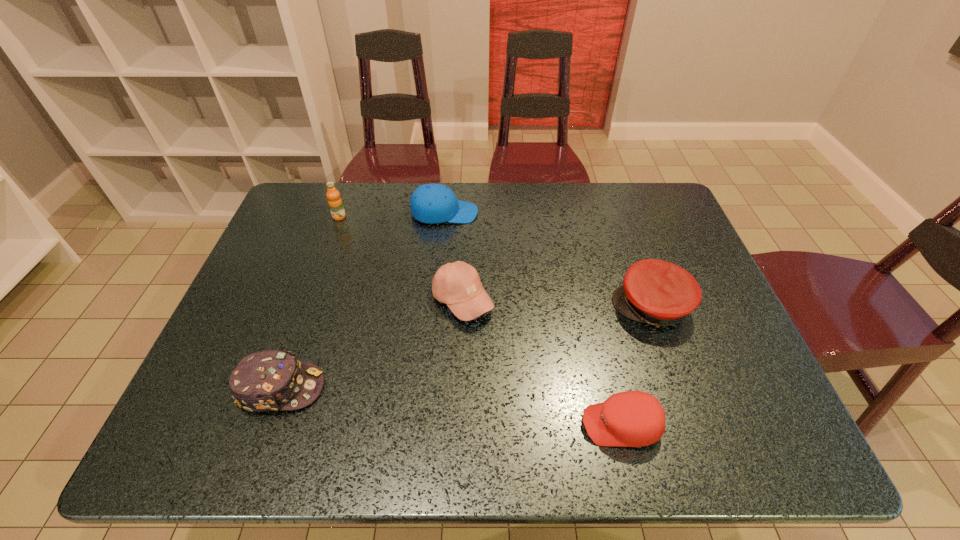
In the image, there is a desktop. Identify the location of vacant region at the near edge. Image resolution: width=960 pixels, height=540 pixels. (362, 427).

Find the location of `free region at the left edge of the desktop`. free region at the left edge of the desktop is located at coordinates [x=307, y=244].

In the image, there is a desktop. Find the location of `free space at the right edge`. free space at the right edge is located at coordinates (661, 232).

Image resolution: width=960 pixels, height=540 pixels. Find the location of `free space at the far left corner of the desktop`. free space at the far left corner of the desktop is located at coordinates (300, 212).

The image size is (960, 540). In order to click on vacant region at the near left corner of the desktop in this screenshot , I will do `click(257, 424)`.

At what (x,y) coordinates should I click in order to perform the action: click on vacant point located between the second farthest cap and the second cap from left to right. Please return your answer as a coordinate pair (x, y). This screenshot has width=960, height=540. Looking at the image, I should click on (548, 260).

This screenshot has height=540, width=960. Find the location of `free space that is in between the third nearest cap and the second cap from left to right`. free space that is in between the third nearest cap and the second cap from left to right is located at coordinates (548, 260).

Locate an element on the screen. free space that is in between the baseball cap and the third nearest cap is located at coordinates (557, 303).

At what (x,y) coordinates should I click in order to perform the action: click on vacant space that's between the leftmost cap and the farthest cap. Please return your answer as a coordinate pair (x, y). This screenshot has width=960, height=540. Looking at the image, I should click on (363, 300).

Locate an element on the screen. The height and width of the screenshot is (540, 960). free area in between the baseball cap and the leftmost cap is located at coordinates (372, 344).